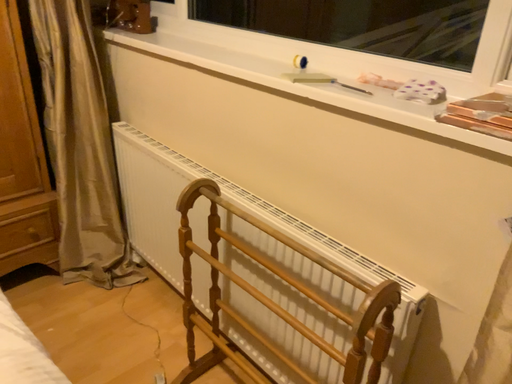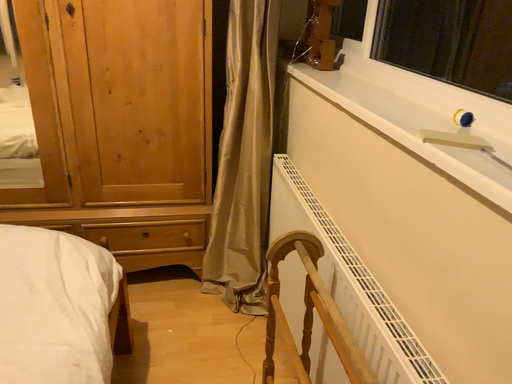
Question: How did the camera likely rotate when shooting the video?

Choices:
 (A) rotated right
 (B) rotated left

Answer: (B)